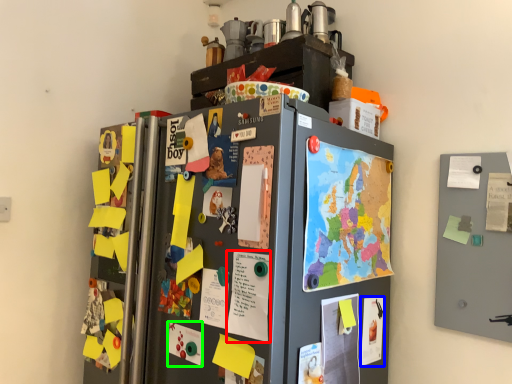
Question: Which object is the closest to the poster (highlighted by a red box)? Choose among these: poster (highlighted by a blue box) or poster (highlighted by a green box).

Choices:
 (A) poster
 (B) poster

Answer: (B)